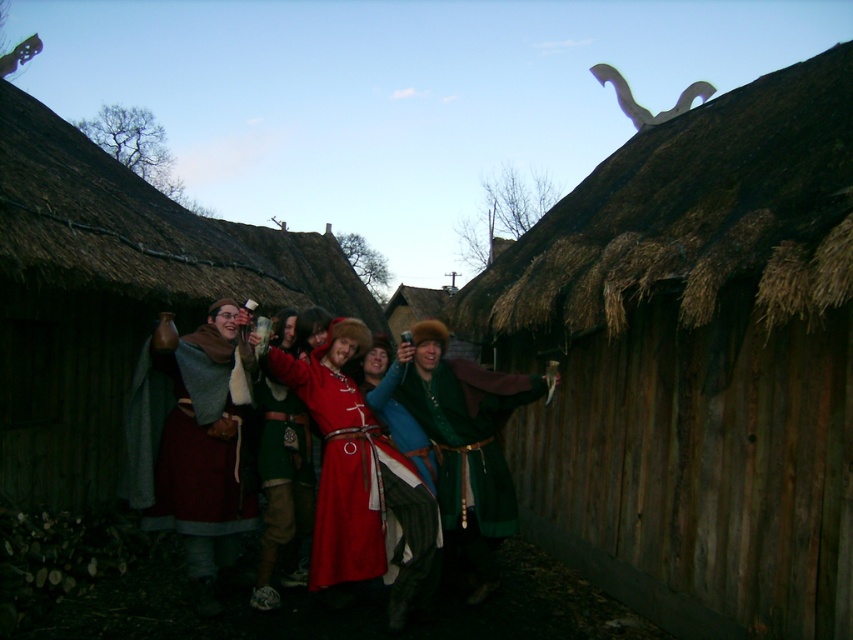
Which is in front, point (693, 128) or point (329, 524)?

Point (329, 524)

At what (x,y) coordinates should I click in order to perform the action: click on brown thatch roof at upper right. Please return your answer as a coordinate pair (x, y). The image size is (853, 640). Looking at the image, I should click on tap(693, 216).

In the scene shown: Does thatched straw hut at center have a lesser width compared to matte red tunic at center?

Incorrect, thatched straw hut at center's width is not less than matte red tunic at center's.

In the scene shown: Who is more distant from viewer, (263, 294) or (329, 401)?

Point (263, 294)

At what (x,y) coordinates should I click in order to perform the action: click on thatched straw hut at center. Please return your answer as a coordinate pair (x, y). This screenshot has height=640, width=853. Looking at the image, I should click on point(112,296).

Between brown thatch roof at upper right and matte woolen cloak at center, which one appears on the left side from the viewer's perspective?

matte woolen cloak at center is more to the left.

Locate an element on the screen. brown thatch roof at upper right is located at coordinates (693, 216).

Locate an element on the screen. The image size is (853, 640). brown thatch roof at upper right is located at coordinates (693, 216).